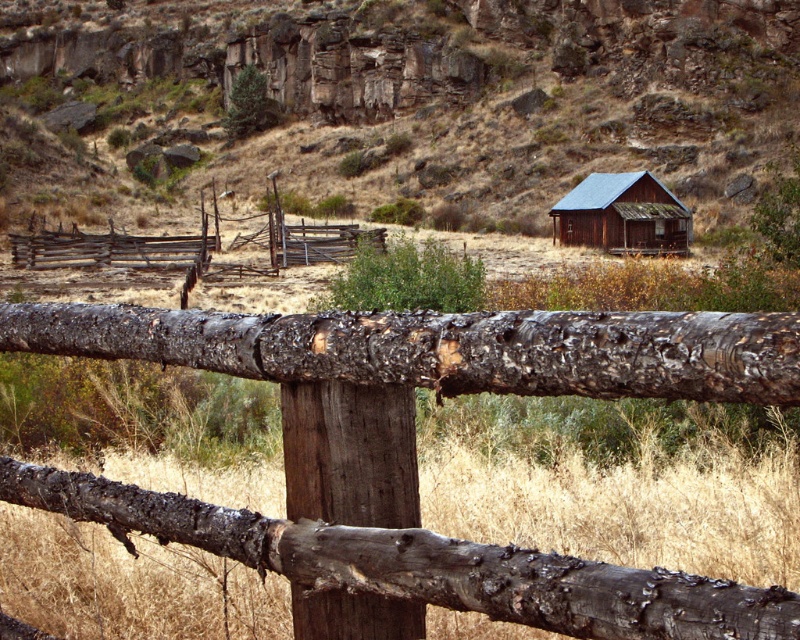
You are standing at the origin point of the image. Which direction should you move to reach the brown wooden fence at center?

The brown wooden fence at center is located at point 0.150 on the x axis and 0.549 on the y axis. Since you are at the origin point, you should move towards the right and upwards to reach it.

You are standing at the edge of a field looking towards the weathered wood fence at center and the rusty wood cabin at center. Which object is closer to you?

The weathered wood fence at center is closer to you because it is positioned below the rusty wood cabin at center, indicating it is in the foreground.